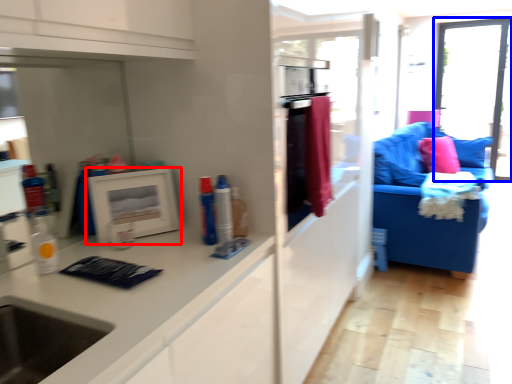
Question: Which object appears closest to the camera in this image, picture frame (highlighted by a red box) or window (highlighted by a blue box)?

Choices:
 (A) picture frame
 (B) window

Answer: (A)